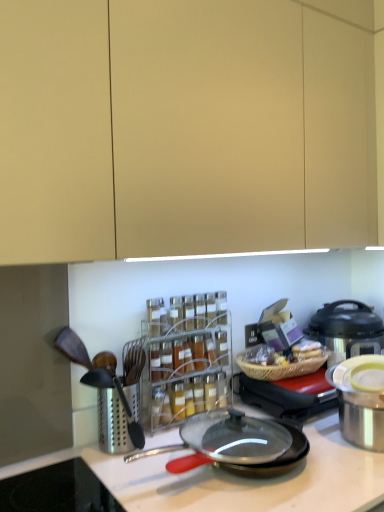
Measure the distance between point (331, 392) and camera.

Point (331, 392) and camera are 1.39 meters apart.

Describe the element at coordinates (289, 396) in the screenshot. I see `metallic silver pot at right, which ranks as the 2th appliance in front-to-back order` at that location.

Describe the element at coordinates (248, 447) in the screenshot. I see `black non-stick frying pan at center` at that location.

Where is `black non-stick frying pan at center`? black non-stick frying pan at center is located at coordinates (248, 447).

Locate an element on the screen. The height and width of the screenshot is (512, 384). stainless steel grater at left is located at coordinates (116, 408).

From a real-world perspective, is black non-stick frying pan at center located beneath stainless steel pot at right, the 1th appliance positioned from the front?

Correct, in the physical world, black non-stick frying pan at center is lower than stainless steel pot at right, the 1th appliance positioned from the front.

In the scene shown: Is black non-stick frying pan at center turned away from stainless steel pot at right, the second appliance viewed from the back?

black non-stick frying pan at center is not turned away from stainless steel pot at right, the second appliance viewed from the back.

Between black non-stick frying pan at center and stainless steel pot at right, the second appliance viewed from the back, which one has smaller width?

stainless steel pot at right, the second appliance viewed from the back.

Is black non-stick frying pan at center shorter than stainless steel pot at right, the 1th appliance positioned from the front?

Yes.

Is clear plastic spice rack at center positioned before stainless steel grater at left?

No, clear plastic spice rack at center is behind stainless steel grater at left.

Is clear plastic spice rack at center outside of stainless steel grater at left?

Yes, clear plastic spice rack at center is not within stainless steel grater at left.

From the image's perspective, relative to stainless steel grater at left, is clear plastic spice rack at center above or below?

clear plastic spice rack at center is situated higher than stainless steel grater at left in the image.

From a real-world perspective, is clear plastic spice rack at center positioned above or below stainless steel grater at left?

In terms of real-world spatial position, clear plastic spice rack at center is above stainless steel grater at left.

Does point (157, 448) appear closer or farther from the camera than point (184, 335)?

Clearly, point (157, 448) is closer to the camera than point (184, 335).

Is black non-stick frying pan at center to the left or to the right of clear plastic spice rack at center in the image?

Clearly, black non-stick frying pan at center is on the right of clear plastic spice rack at center in the image.

Can we say black non-stick frying pan at center lies outside clear plastic spice rack at center?

Absolutely, black non-stick frying pan at center is external to clear plastic spice rack at center.

Considering the sizes of clear plastic spice rack at center and stainless steel pot at right, the second appliance viewed from the back, in the image, is clear plastic spice rack at center taller or shorter than stainless steel pot at right, the second appliance viewed from the back,?

In the image, clear plastic spice rack at center appears to be taller than stainless steel pot at right, the second appliance viewed from the back.

Does point (169, 374) come farther from viewer compared to point (375, 418)?

Yes, point (169, 374) is farther from viewer.

Who is bigger, clear plastic spice rack at center or stainless steel pot at right, the second appliance viewed from the back?

clear plastic spice rack at center.

Based on the photo, who is shorter, stainless steel pot at right, the 1th appliance positioned from the front, or metallic silver pressure cooker at right?

stainless steel pot at right, the 1th appliance positioned from the front.

Considering their positions, is stainless steel pot at right, the 1th appliance positioned from the front, located in front of or behind metallic silver pressure cooker at right?

Clearly, stainless steel pot at right, the 1th appliance positioned from the front, is in front of metallic silver pressure cooker at right.

In the scene shown: Is stainless steel pot at right, the 1th appliance positioned from the front, surrounding metallic silver pressure cooker at right?

No, metallic silver pressure cooker at right is located outside of stainless steel pot at right, the 1th appliance positioned from the front.

Considering the sizes of stainless steel pot at right, the 1th appliance positioned from the front, and metallic silver pot at right, arranged as the first appliance when viewed from the back, in the image, is stainless steel pot at right, the 1th appliance positioned from the front, wider or thinner than metallic silver pot at right, arranged as the first appliance when viewed from the back,?

Considering their sizes, stainless steel pot at right, the 1th appliance positioned from the front, looks slimmer than metallic silver pot at right, arranged as the first appliance when viewed from the back.

How different are the orientations of stainless steel pot at right, the 1th appliance positioned from the front, and metallic silver pot at right, which ranks as the 2th appliance in front-to-back order, in degrees?

0.0656 degrees separate the facing orientations of stainless steel pot at right, the 1th appliance positioned from the front, and metallic silver pot at right, which ranks as the 2th appliance in front-to-back order.

Can you confirm if stainless steel pot at right, the second appliance viewed from the back, is shorter than metallic silver pot at right, arranged as the first appliance when viewed from the back?

In fact, stainless steel pot at right, the second appliance viewed from the back, may be taller than metallic silver pot at right, arranged as the first appliance when viewed from the back.

Does stainless steel grater at left have a lesser width compared to black non-stick frying pan at center?

Correct, the width of stainless steel grater at left is less than that of black non-stick frying pan at center.

Is point (100, 392) positioned behind point (181, 469)?

Yes.

Looking at this image, from the image's perspective, is stainless steel grater at left beneath black non-stick frying pan at center?

No, from the image's perspective, stainless steel grater at left is not below black non-stick frying pan at center.

This screenshot has height=512, width=384. There is a black non-stick frying pan at center. In order to click on the 1st appliance above it (from a real-world perspective) in this screenshot , I will do click(x=358, y=408).

Find the location of `utensil on the left of clear plastic spice rack at center`. utensil on the left of clear plastic spice rack at center is located at coordinates (116, 408).

Looking at the image, which one is located closer to metallic silver pressure cooker at right, stainless steel grater at left or stainless steel pot at right, the second appliance viewed from the back?

stainless steel pot at right, the second appliance viewed from the back, is positioned closer to the anchor metallic silver pressure cooker at right.

When comparing their distances from clear plastic spice rack at center, does black non-stick frying pan at center or stainless steel pot at right, the second appliance viewed from the back, seem further?

The object further to clear plastic spice rack at center is stainless steel pot at right, the second appliance viewed from the back.

Estimate the real-world distances between objects in this image. Which object is closer to metallic silver pot at right, which ranks as the 2th appliance in front-to-back order, black non-stick frying pan at center or metallic silver pressure cooker at right?

black non-stick frying pan at center.

When comparing their distances from metallic silver pot at right, arranged as the first appliance when viewed from the back, does clear plastic spice rack at center or stainless steel grater at left seem further?

Based on the image, stainless steel grater at left appears to be further to metallic silver pot at right, arranged as the first appliance when viewed from the back.

Considering their positions, is stainless steel grater at left positioned closer to metallic silver pressure cooker at right than clear plastic spice rack at center?

clear plastic spice rack at center is closer to metallic silver pressure cooker at right.

Estimate the real-world distances between objects in this image. Which object is closer to metallic silver pressure cooker at right, clear plastic spice rack at center or black non-stick frying pan at center?

clear plastic spice rack at center lies closer to metallic silver pressure cooker at right than the other object.

When comparing their distances from stainless steel grater at left, does stainless steel pot at right, the second appliance viewed from the back, or metallic silver pot at right, arranged as the first appliance when viewed from the back, seem closer?

Among the two, metallic silver pot at right, arranged as the first appliance when viewed from the back, is located nearer to stainless steel grater at left.

From the image, which object appears to be farther from stainless steel grater at left, black non-stick frying pan at center or metallic silver pressure cooker at right?

Among the two, metallic silver pressure cooker at right is located further to stainless steel grater at left.

Find the location of a particular element. The image size is (384, 512). utensil located between black non-stick frying pan at center and clear plastic spice rack at center in the depth direction is located at coordinates (116, 408).

The image size is (384, 512). In order to click on frying pan located between clear plastic spice rack at center and stainless steel pot at right, the 1th appliance positioned from the front, in the left-right direction in this screenshot , I will do 248,447.

You are a GUI agent. You are given a task and a screenshot of the screen. Output one action in this format:
    pyautogui.click(x=<x>, y=<y>)
    Task: Click on the spice rack between stainless steel grater at left and metallic silver pot at right, arranged as the first appliance when viewed from the back, in the horizontal direction
    The image size is (384, 512).
    Given the screenshot: What is the action you would take?
    pyautogui.click(x=187, y=365)

Locate an element on the screen. frying pan situated between stainless steel grater at left and metallic silver pot at right, which ranks as the 2th appliance in front-to-back order, from left to right is located at coordinates (248, 447).